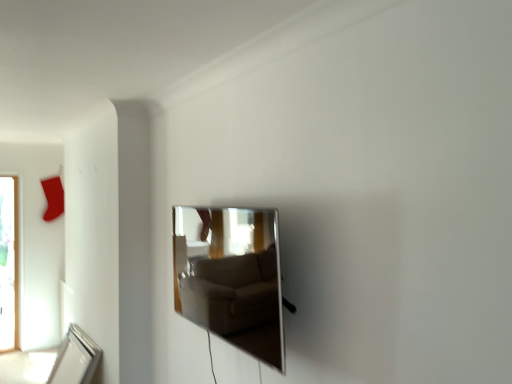
Question: Considering the relative sizes of silver metallic mirror at lower left, which is the first mirror from back to front, and polished silver mirror at center, the 2th mirror positioned from the back, in the image provided, is silver metallic mirror at lower left, which is the first mirror from back to front, thinner than polished silver mirror at center, the 2th mirror positioned from the back,?

Choices:
 (A) yes
 (B) no

Answer: (B)

Question: Can you confirm if silver metallic mirror at lower left, which is the second mirror in front-to-back order, is shorter than polished silver mirror at center, which appears as the 2th mirror when ordered from the bottom?

Choices:
 (A) no
 (B) yes

Answer: (B)

Question: From a real-world perspective, is silver metallic mirror at lower left, the 2th mirror viewed from the top, located higher than polished silver mirror at center, which is counted as the 1th mirror, starting from the front?

Choices:
 (A) no
 (B) yes

Answer: (A)

Question: Does silver metallic mirror at lower left, marked as the first mirror in a left-to-right arrangement, lie in front of polished silver mirror at center, marked as the first mirror in a top-to-bottom arrangement?

Choices:
 (A) yes
 (B) no

Answer: (B)

Question: From the image's perspective, is silver metallic mirror at lower left, marked as the first mirror in a left-to-right arrangement, above polished silver mirror at center, marked as the first mirror in a top-to-bottom arrangement?

Choices:
 (A) no
 (B) yes

Answer: (A)

Question: Is silver metallic mirror at lower left, which is the second mirror in front-to-back order, not near polished silver mirror at center, the first mirror positioned from the right?

Choices:
 (A) yes
 (B) no

Answer: (A)

Question: From the image's perspective, would you say polished silver mirror at center, marked as the first mirror in a top-to-bottom arrangement, is shown under silver metallic mirror at lower left, marked as the first mirror in a left-to-right arrangement?

Choices:
 (A) no
 (B) yes

Answer: (A)

Question: Is polished silver mirror at center, which is counted as the 1th mirror, starting from the front, further to the viewer compared to silver metallic mirror at lower left, which is the first mirror from back to front?

Choices:
 (A) no
 (B) yes

Answer: (A)

Question: From a real-world perspective, is polished silver mirror at center, marked as the 2th mirror in a left-to-right arrangement, under silver metallic mirror at lower left, the second mirror when ordered from right to left?

Choices:
 (A) no
 (B) yes

Answer: (A)

Question: Is polished silver mirror at center, the 2th mirror positioned from the back, in contact with silver metallic mirror at lower left, the second mirror when ordered from right to left?

Choices:
 (A) yes
 (B) no

Answer: (B)

Question: Could you tell me if polished silver mirror at center, marked as the first mirror in a top-to-bottom arrangement, is turned towards silver metallic mirror at lower left, which is the second mirror in front-to-back order?

Choices:
 (A) no
 (B) yes

Answer: (A)

Question: Is polished silver mirror at center, marked as the first mirror in a top-to-bottom arrangement, facing away from silver metallic mirror at lower left, the first mirror from the bottom?

Choices:
 (A) yes
 (B) no

Answer: (B)

Question: From a real-world perspective, is silver metallic mirror at lower left, which is the second mirror in front-to-back order, physically located above or below polished silver mirror at center, the 2th mirror positioned from the back?

Choices:
 (A) above
 (B) below

Answer: (B)